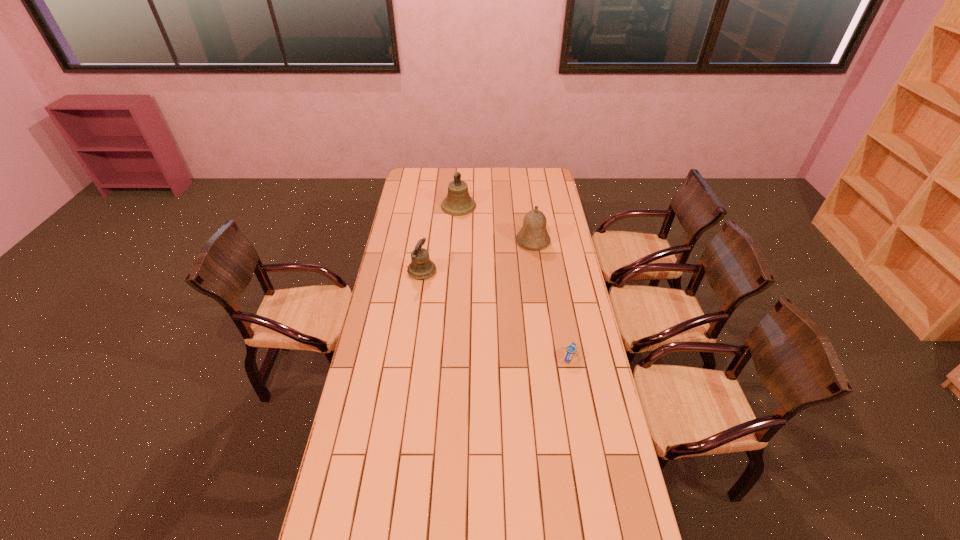
What are the coordinates of `the farthest object` in the screenshot? It's located at (458, 202).

What are the coordinates of `the second nearest bell` in the screenshot? It's located at (533, 235).

Find the location of a particular element. The width and height of the screenshot is (960, 540). the rightmost bell is located at coordinates (533, 235).

Identify the location of the shortest bell. Image resolution: width=960 pixels, height=540 pixels. (421, 267).

Identify the location of the nearest bell. The height and width of the screenshot is (540, 960). click(x=421, y=267).

Identify the location of the nearest object. Image resolution: width=960 pixels, height=540 pixels. (570, 349).

Identify the location of the shortest object. The image size is (960, 540). (570, 349).

Locate an element on the screen. The height and width of the screenshot is (540, 960). free space located 0.180m on the right of the farthest object is located at coordinates (508, 206).

What are the coordinates of `vacant region located on the front of the third nearest object` in the screenshot? It's located at click(x=536, y=259).

Locate an element on the screen. vacant space located on the front of the second shortest object is located at coordinates (416, 314).